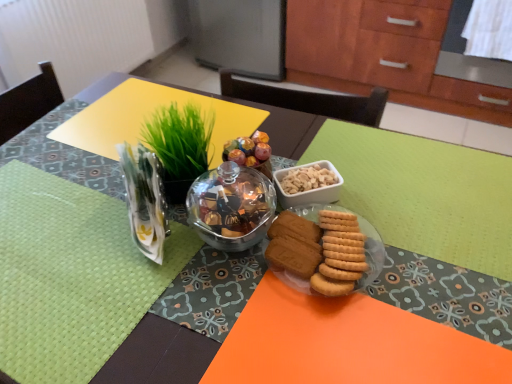
What are the coordinates of `free spot to the left of golden matte cookies at center` in the screenshot? It's located at pyautogui.click(x=207, y=285).